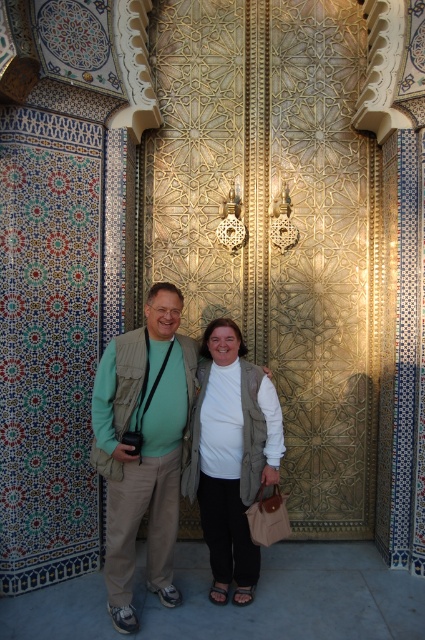
You are a photographer trying to capture a clear photo of the ornate door in the background. You notice two items in the foreground that might obstruct your shot. Can you determine if the green fabric vest at center and the white cotton shirt at center are close enough to each other to create a single obstruction in your photo?

The distance between the green fabric vest at center and the white cotton shirt at center is 15.81 inches, which means they are close enough to form a single obstruction in the photo.

Looking at this image, you are a photographer trying to capture the intricate details of the mosque door. You notice two people in the frame wearing a green fabric vest at center and a white cotton shirt at center. Which clothing item is closer to the left side of the frame?

The green fabric vest at center is positioned on the left side of the white cotton shirt at center, so the green fabric vest at center is closer to the left side of the frame.

You are a photographer trying to capture the intricate details of the ornate door in the background. You notice two clothing items on the person in front of you blocking your view. Which clothing item, the green fabric vest at center or the white cotton shirt at center, is more likely to obstruct your view of the door because it is larger?

The green fabric vest at center is larger in size than the white cotton shirt at center, so the green fabric vest at center is more likely to obstruct your view of the door.